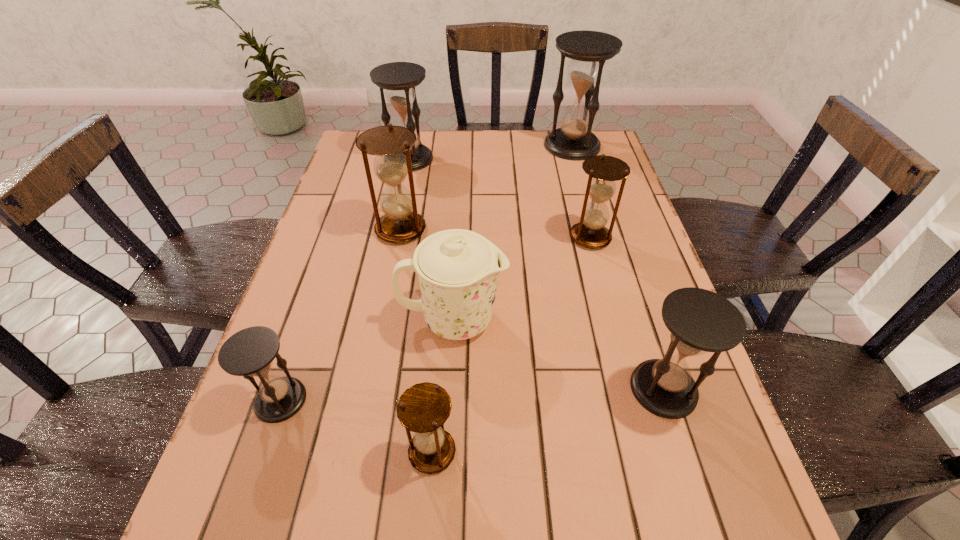
I want to click on object situated at the far right corner, so click(588, 50).

Identify the location of free space at the far edge of the desktop. The width and height of the screenshot is (960, 540). (441, 141).

You are a GUI agent. You are given a task and a screenshot of the screen. Output one action in this format:
    pyautogui.click(x=<x>, y=<y>)
    Task: Click on the free space at the left edge
    The image size is (960, 540).
    Given the screenshot: What is the action you would take?
    pyautogui.click(x=346, y=305)

You are a GUI agent. You are given a task and a screenshot of the screen. Output one action in this format:
    pyautogui.click(x=<x>, y=<y>)
    Task: Click on the free spot at the right edge of the desktop
    This screenshot has height=540, width=960.
    Given the screenshot: What is the action you would take?
    pyautogui.click(x=595, y=284)

Identify the location of vacant area that lies between the second black hourglass from left to right and the leftmost hourglass. The width and height of the screenshot is (960, 540). (345, 279).

The height and width of the screenshot is (540, 960). Identify the location of vacant area between the rightmost brown hourglass and the second smallest black hourglass. (627, 313).

I want to click on free area in between the third biggest black hourglass and the tallest object, so click(618, 267).

The image size is (960, 540). I want to click on free space between the biggest brown hourglass and the leftmost black hourglass, so click(x=341, y=315).

Where is `vacant region between the nearest object and the third biggest black hourglass`? The height and width of the screenshot is (540, 960). vacant region between the nearest object and the third biggest black hourglass is located at coordinates (548, 420).

In order to click on vacant area between the chinaware and the second smallest brown hourglass in this screenshot , I will do `click(521, 279)`.